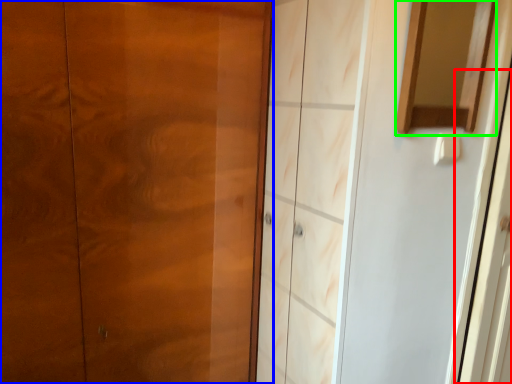
Question: Which object is positioned farthest from screen door (highlighted by a red box)? Select from door (highlighted by a blue box) and mirror (highlighted by a green box).

Choices:
 (A) door
 (B) mirror

Answer: (A)